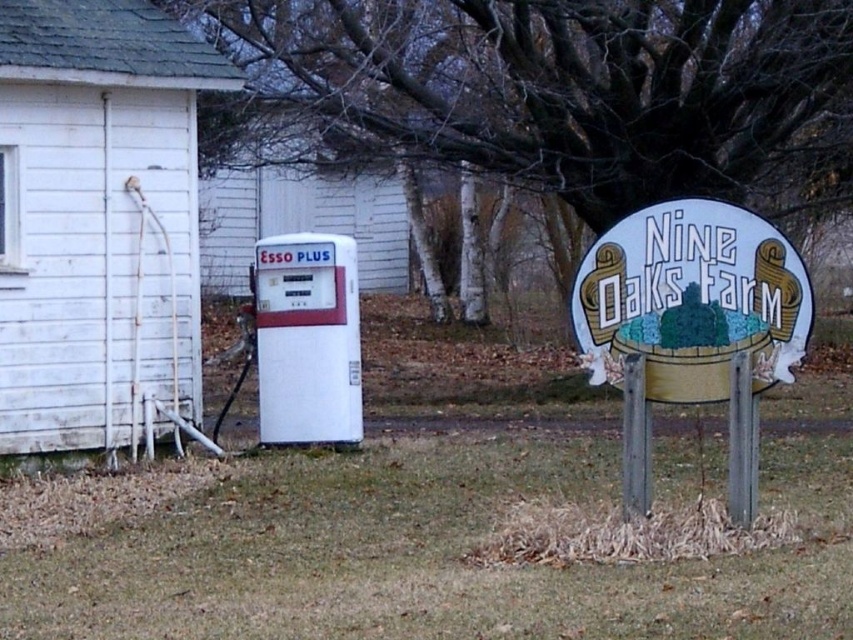
Question: Which object is positioned closest to the white plastic gas pump at center?

Choices:
 (A) white matte gas pump at center
 (B) white wooden sign at center right
 (C) white wood hut at left

Answer: (A)

Question: Observing the image, what is the correct spatial positioning of white wood hut at left in reference to white plastic gas pump at center?

Choices:
 (A) right
 (B) left

Answer: (A)

Question: Estimate the real-world distances between objects in this image. Which object is farther from the white wooden sign at center right?

Choices:
 (A) white matte gas pump at center
 (B) white plastic gas pump at center

Answer: (B)

Question: Which point is farther to the camera?

Choices:
 (A) white wooden sign at center right
 (B) white wood hut at left
 (C) white matte gas pump at center
 (D) white plastic gas pump at center

Answer: (D)

Question: Is white matte gas pump at center closer to camera compared to white wooden sign at center right?

Choices:
 (A) yes
 (B) no

Answer: (A)

Question: Can you confirm if white matte gas pump at center is smaller than white plastic gas pump at center?

Choices:
 (A) yes
 (B) no

Answer: (B)